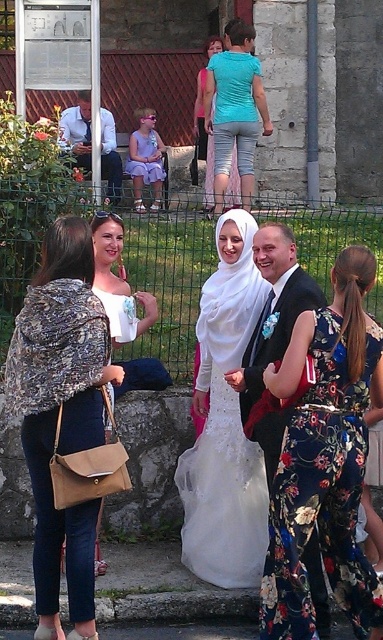
Where is `floral print dress at center`? The image size is (383, 640). floral print dress at center is located at coordinates (325, 460).

Measure the distance from floral print dress at center to patterned fabric shawl at left.

The distance of floral print dress at center from patterned fabric shawl at left is 1.97 meters.

Which is behind, point (317, 493) or point (62, 321)?

Positioned behind is point (62, 321).

Find the location of a particular element. floral print dress at center is located at coordinates (325, 460).

Which is more to the left, patterned fabric shawl at left or white satin veil at center?

Positioned to the left is patterned fabric shawl at left.

Which is in front, point (44, 598) or point (255, 292)?

Positioned in front is point (44, 598).

The image size is (383, 640). Identify the location of patterned fabric shawl at left. (62, 412).

Can you confirm if shiny black suit at center is positioned above matte black suit at center?

Incorrect, shiny black suit at center is not positioned above matte black suit at center.

Which of these two, shiny black suit at center or matte black suit at center, stands taller?

matte black suit at center

Is point (240, 417) positioned behind point (207, 93)?

That is False.

Find the location of a particular element. shiny black suit at center is located at coordinates (273, 310).